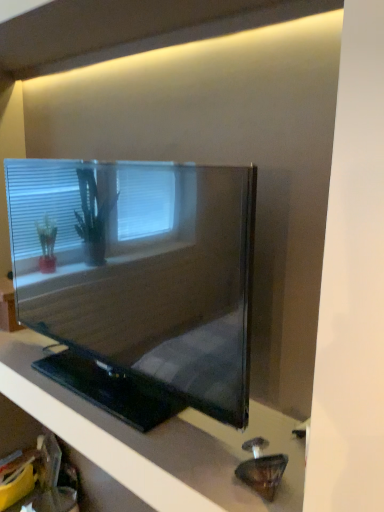
The image size is (384, 512). I want to click on blank space situated above black glossy tv at center (from a real-world perspective), so click(109, 397).